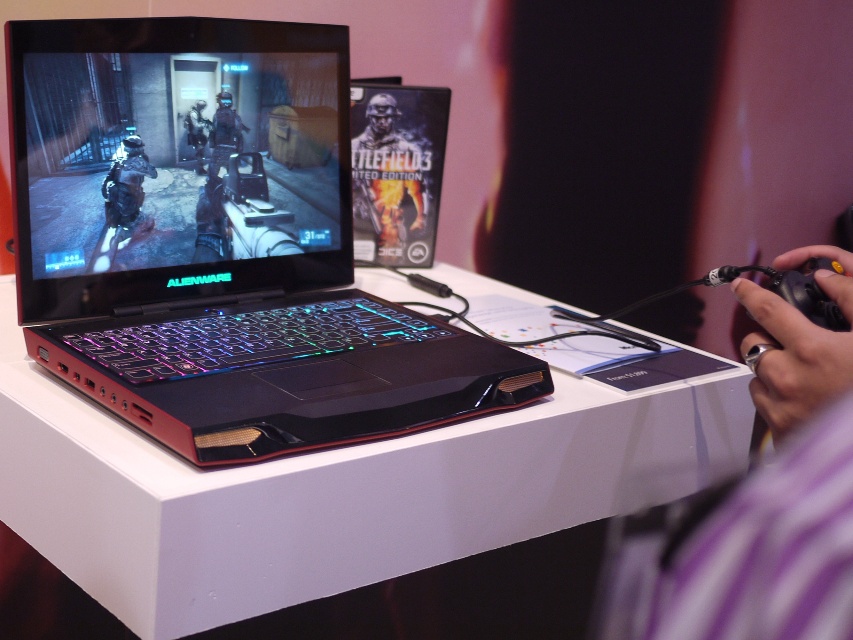
At what (x,y) coordinates should I click in order to perform the action: click on white glossy table at center. Please return your answer as a coordinate pair (x, y). Looking at the image, I should click on (334, 490).

Does point (553, 435) lie behind point (834, 449)?

Yes, point (553, 435) is farther from viewer.

The height and width of the screenshot is (640, 853). Find the location of `white glossy table at center`. white glossy table at center is located at coordinates (334, 490).

Where is `matte black laptop at center`? This screenshot has height=640, width=853. matte black laptop at center is located at coordinates (216, 243).

Between matte black laptop at center and white glossy table at center, which one is positioned lower?

Positioned lower is white glossy table at center.

Measure the distance between matte black laptop at center and camera.

matte black laptop at center is 25.88 inches away from camera.

Find the location of a particular element. The height and width of the screenshot is (640, 853). matte black laptop at center is located at coordinates (216, 243).

Between matte black laptop at center and metallic helmet at center, which one has more height?

matte black laptop at center

Can you confirm if matte black laptop at center is positioned to the left of metallic helmet at center?

Correct, you'll find matte black laptop at center to the left of metallic helmet at center.

You are a GUI agent. You are given a task and a screenshot of the screen. Output one action in this format:
    pyautogui.click(x=<x>, y=<y>)
    Task: Click on the matte black laptop at center
    
    Given the screenshot: What is the action you would take?
    pyautogui.click(x=216, y=243)